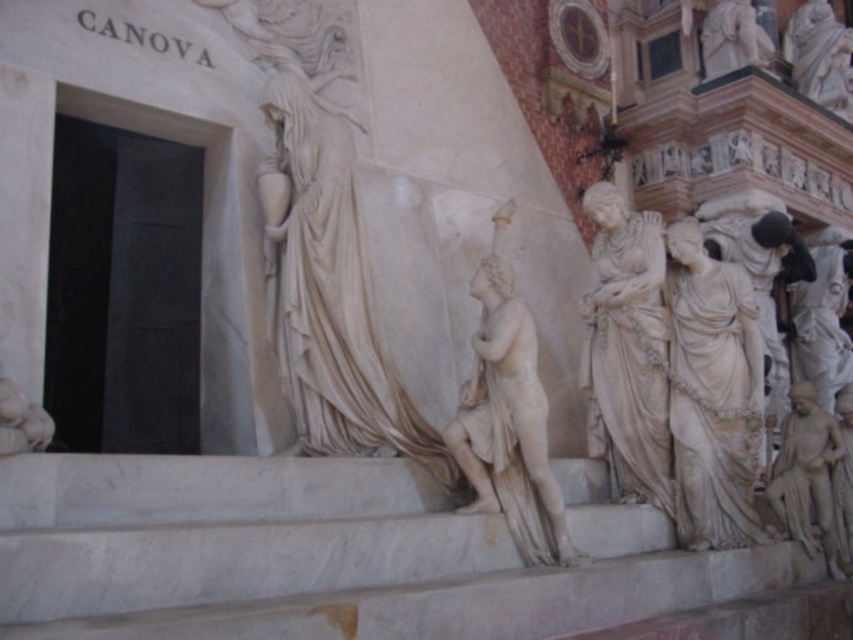
Question: Which point is closer to the camera?

Choices:
 (A) (833, 13)
 (B) (749, 326)
 (C) (537, 435)

Answer: (C)

Question: Is white marble statue at right bigger than white marble statue at upper right?

Choices:
 (A) yes
 (B) no

Answer: (B)

Question: Considering the relative positions of white marble statue at center and white marble statue at right in the image provided, where is white marble statue at center located with respect to white marble statue at right?

Choices:
 (A) right
 (B) left

Answer: (B)

Question: Can you confirm if white marble draped cloth at right is positioned below white marble statue at right?

Choices:
 (A) no
 (B) yes

Answer: (A)

Question: Which object appears closest to the camera in this image?

Choices:
 (A) white marble statue at right
 (B) white marble draped cloth at right

Answer: (B)

Question: Which object appears farthest from the camera in this image?

Choices:
 (A) white marble draped cloth at right
 (B) white marble statue at center
 (C) white marble statue at upper right

Answer: (C)